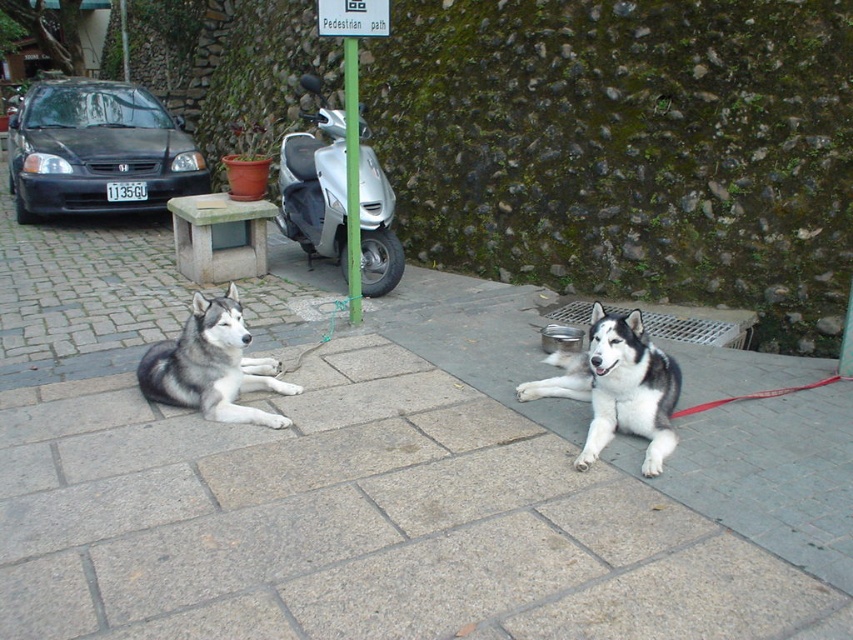
Which is more to the left, gray stone pavement at center or silver metallic scooter at center?

silver metallic scooter at center is more to the left.

Which is behind, point (811, 380) or point (360, 161)?

The point (360, 161) is behind.

Where is `gray stone pavement at center`? gray stone pavement at center is located at coordinates (383, 480).

Is matte black car at left to the left of gray fur husky at center from the viewer's perspective?

Yes, matte black car at left is to the left of gray fur husky at center.

This screenshot has width=853, height=640. What do you see at coordinates (97, 150) in the screenshot?
I see `matte black car at left` at bounding box center [97, 150].

Locate an element on the screen. matte black car at left is located at coordinates (97, 150).

Based on the photo, who is taller, black and white fur dog at center or green painted metal pole at center?

green painted metal pole at center

Which is behind, point (560, 349) or point (352, 179)?

Positioned behind is point (352, 179).

Is point (608, 381) in front of point (346, 116)?

Yes, it is.

Find the location of a particular element. Image resolution: width=853 pixels, height=640 pixels. black and white fur dog at center is located at coordinates (616, 387).